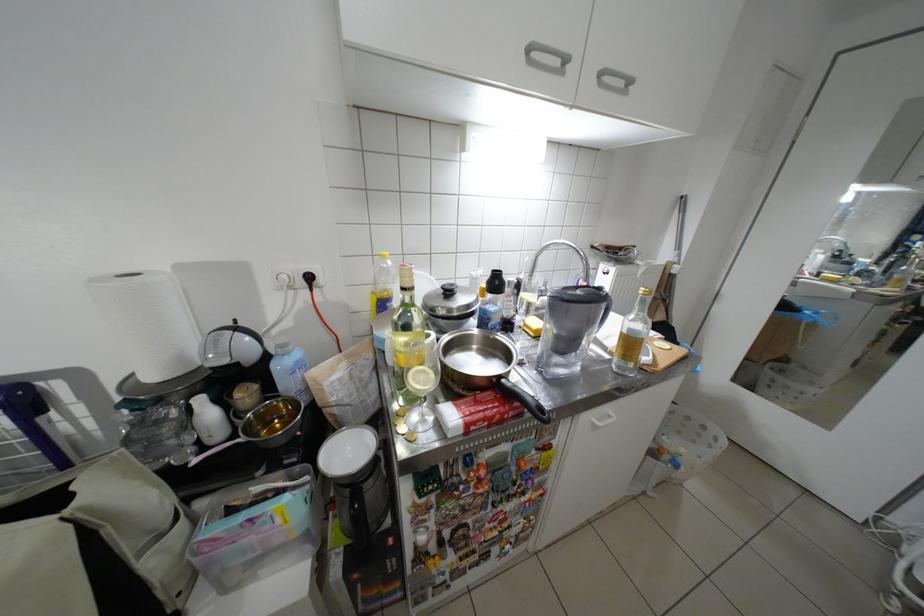
Locate an element on the screen. Image resolution: width=924 pixels, height=616 pixels. blue dispenser bottle is located at coordinates (289, 370).